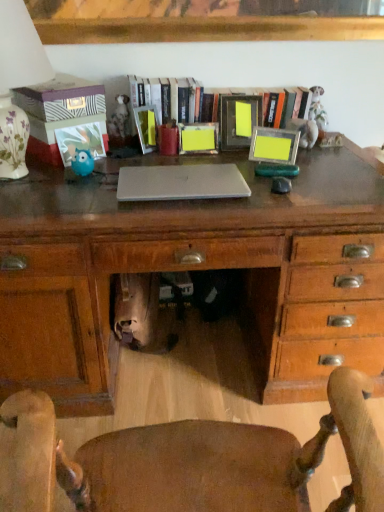
At what (x,y) coordinates should I click in order to perform the action: click on vacant point above matte wooden desk at center (from a real-world perspective). Please return your answer as a coordinate pair (x, y). The image size is (384, 512). Looking at the image, I should click on (161, 164).